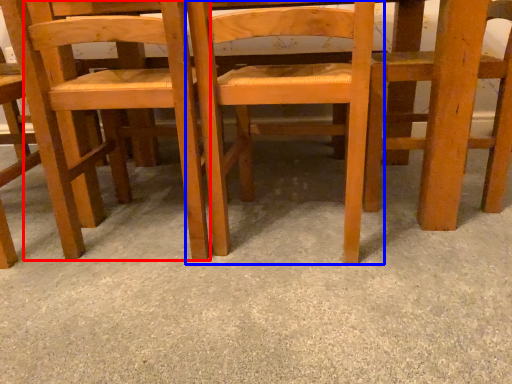
Question: Which point is closer to the camera, chair (highlighted by a red box) or chair (highlighted by a blue box)?

Choices:
 (A) chair
 (B) chair

Answer: (B)